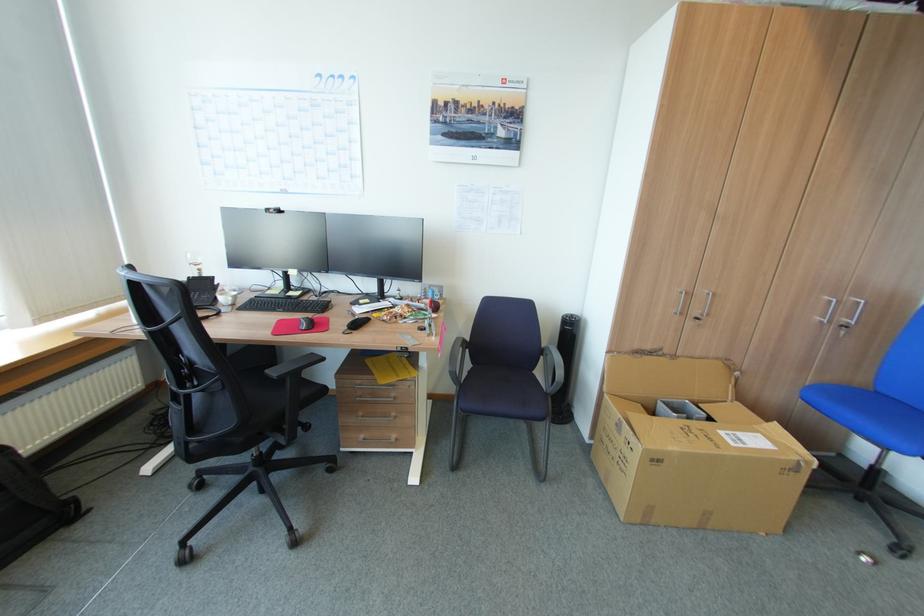
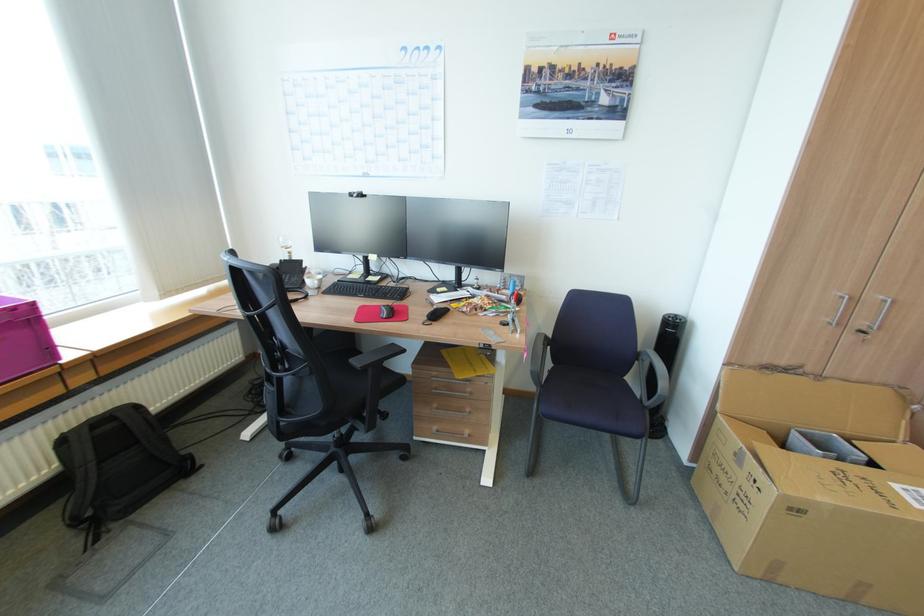
Question: The camera is either moving clockwise (left) or counter-clockwise (right) around the object. The first image is from the beginning of the video and the second image is from the end. Is the camera moving left or right when shooting the video?

Choices:
 (A) Left
 (B) Right

Answer: (B)